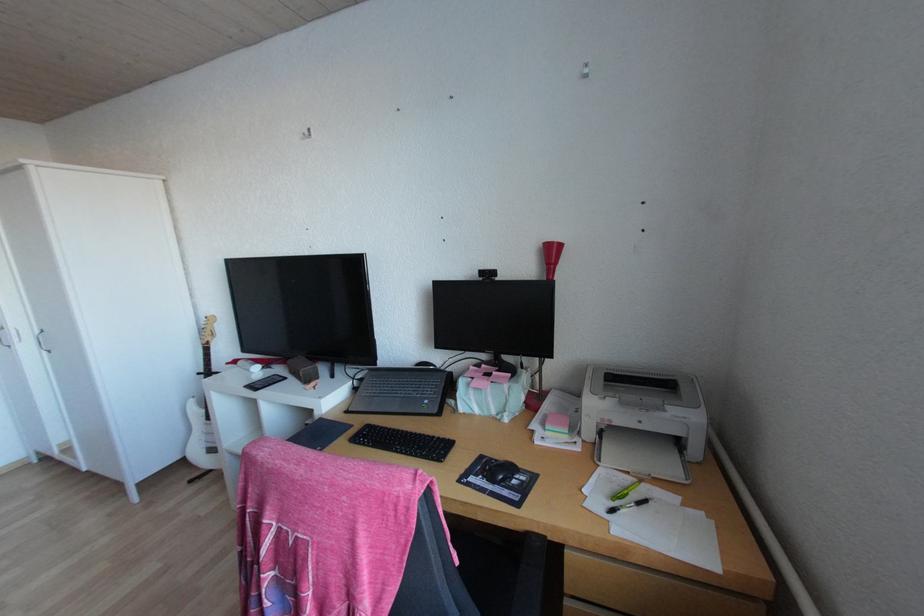
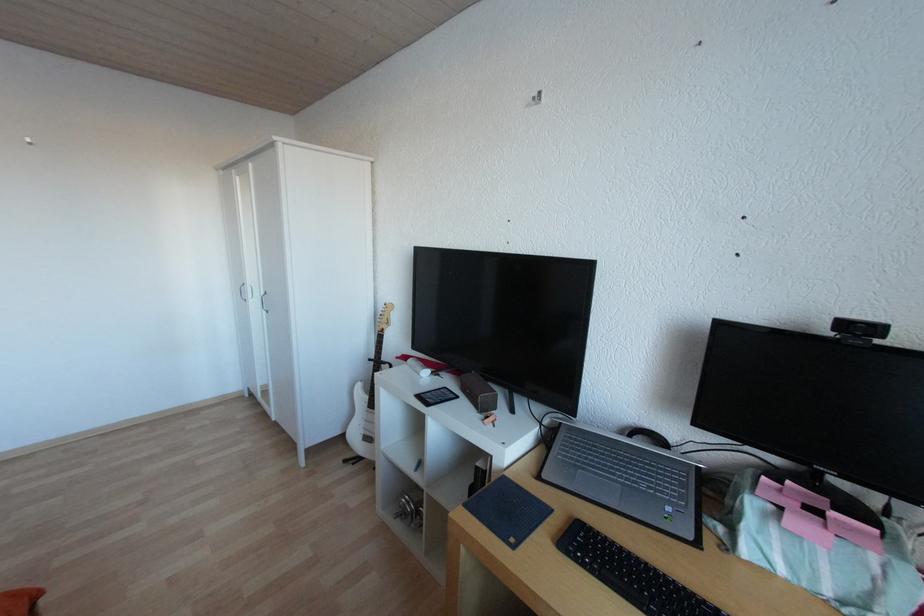
Question: Based on the continuous images, in which direction is the camera rotating? Reply with the corresponding letter.

Choices:
 (A) Left
 (B) Right
 (C) Up
 (D) Down

Answer: (A)